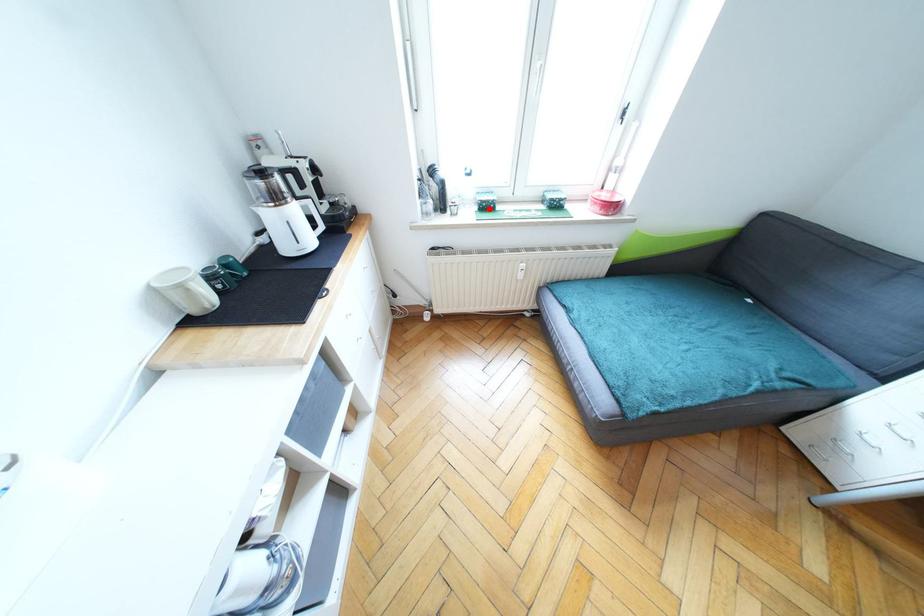
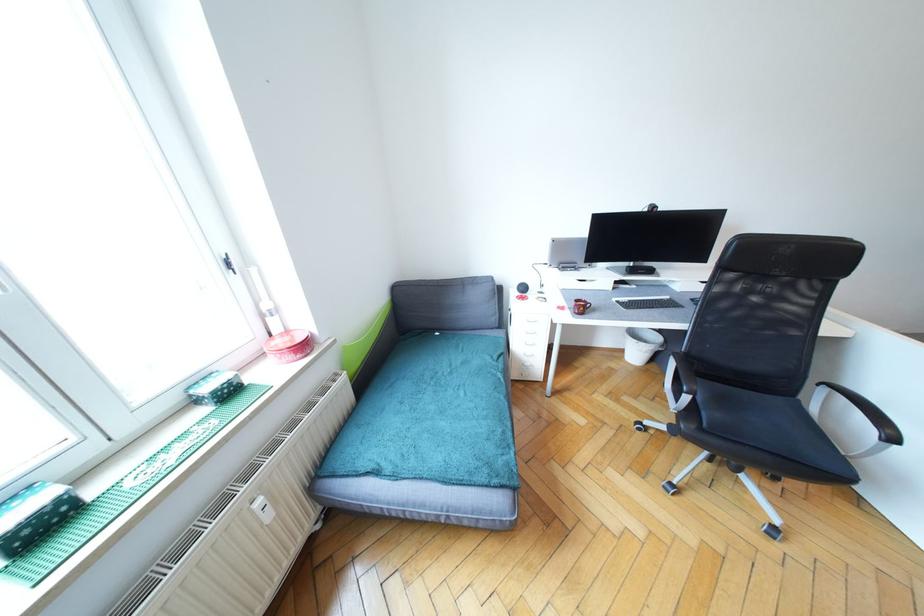
Locate, in the second image, the point that corresponds to the highlighted location in the first image.

(45, 530)